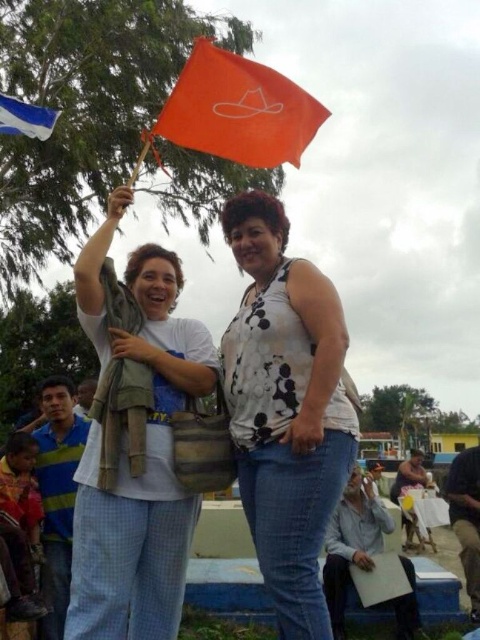
Question: Can you confirm if white cotton shirt at upper left is positioned below orange matte flag at upper center?

Choices:
 (A) yes
 (B) no

Answer: (A)

Question: Is white printed tank top at center above blue fabric flag at upper left?

Choices:
 (A) yes
 (B) no

Answer: (B)

Question: In this image, where is white printed tank top at center located relative to blue fabric flag at upper left?

Choices:
 (A) left
 (B) right

Answer: (B)

Question: Which object is the closest to the white cotton shirt at upper left?

Choices:
 (A) blue fabric flag at upper left
 (B) white printed tank top at center
 (C) orange matte flag at upper center

Answer: (B)

Question: Which of the following is the farthest from the observer?

Choices:
 (A) orange matte flag at upper center
 (B) white cotton shirt at upper left

Answer: (A)

Question: Among these objects, which one is nearest to the camera?

Choices:
 (A) white printed tank top at center
 (B) white cotton shirt at upper left
 (C) blue fabric flag at upper left

Answer: (A)